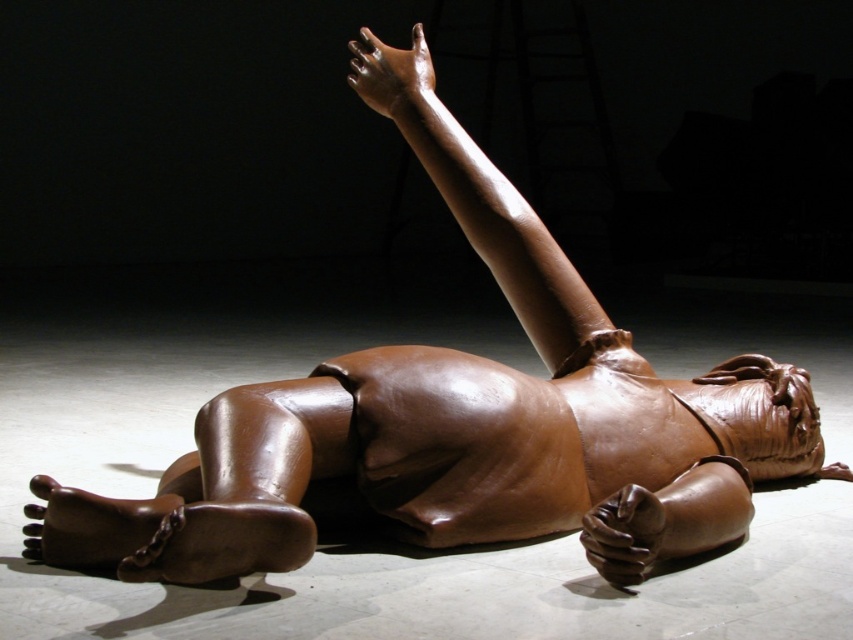
You are an art conservator examining the sculpture. You notice the shiny brown arm at upper center and the shiny brown hand at lower right. Which object is positioned higher up in the sculpture?

The shiny brown arm at upper center is located above the shiny brown hand at lower right, so the shiny brown arm at upper center is positioned higher up in the sculpture.

You are standing in front of the sculpture and want to know how far the point at coordinates point (381,67) is from you. Can you determine the distance?

The point (381,67) is 11.88 feet away from the viewer.

You are an art conservator examining the sculpture. You notice two points on the sculpture at coordinates point [426,90] and point [409,76]. Which point is closer to your current position?

Point [426,90] is closer to the camera than point [409,76], so the point [426,90] is closer to your current position.